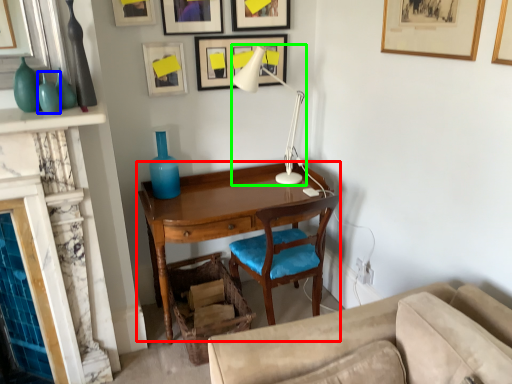
Question: Considering the real-world distances, which object is closest to desk (highlighted by a red box)? turquoise (highlighted by a blue box) or table lamp (highlighted by a green box).

Choices:
 (A) turquoise
 (B) table lamp

Answer: (B)